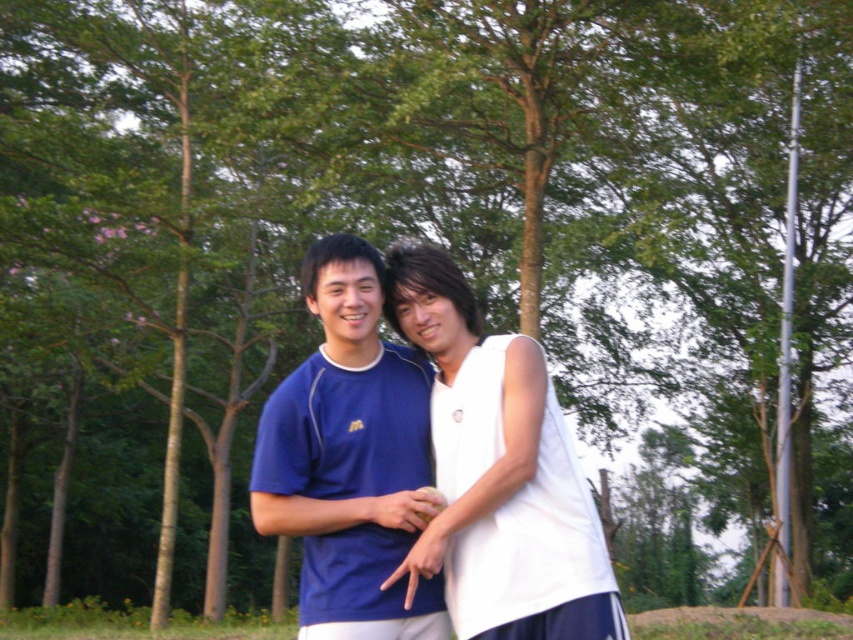
Question: Which of the following is the farthest from the observer?

Choices:
 (A) (512, 611)
 (B) (264, 476)

Answer: (B)

Question: Does white matte tank top at center have a lesser width compared to matte blue shirt at center?

Choices:
 (A) no
 (B) yes

Answer: (A)

Question: Is white matte tank top at center wider than matte blue shirt at center?

Choices:
 (A) no
 (B) yes

Answer: (B)

Question: Is white matte tank top at center below matte blue shirt at center?

Choices:
 (A) yes
 (B) no

Answer: (A)